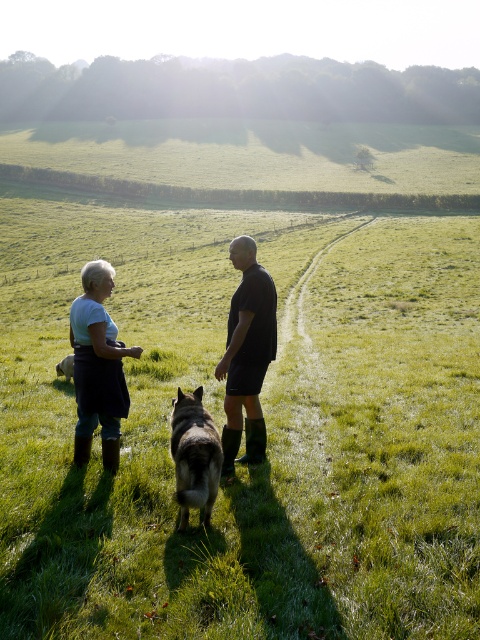
Between dark matte shirt at center and brown fur dog at lower left, which one appears on the left side from the viewer's perspective?

brown fur dog at lower left is more to the left.

Is point (247, 358) closer to viewer compared to point (60, 371)?

Yes, point (247, 358) is in front of point (60, 371).

Which is in front, point (264, 304) or point (62, 371)?

Point (264, 304) is in front.

Identify the location of dark matte shirt at center. The height and width of the screenshot is (640, 480). (247, 355).

Does white cotton shirt at left have a lesser width compared to brown fur dog at lower left?

Correct, white cotton shirt at left's width is less than brown fur dog at lower left's.

Who is more forward, (74, 365) or (69, 355)?

Point (74, 365) is more forward.

Find the location of a particular element. The width and height of the screenshot is (480, 640). white cotton shirt at left is located at coordinates (97, 365).

Can you confirm if dark gray fur at center is shorter than brown fur dog at lower left?

Incorrect, dark gray fur at center's height does not fall short of brown fur dog at lower left's.

How far apart are dark gray fur at center and brown fur dog at lower left?

4.48 meters

Is point (178, 529) more distant than point (66, 360)?

That is False.

Identify the location of dark gray fur at center. The width and height of the screenshot is (480, 640). (193, 456).